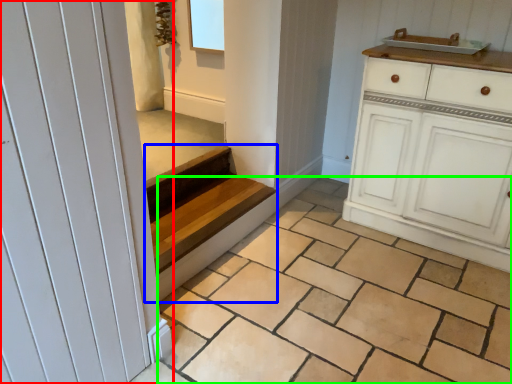
Question: Which is farther away from door (highlighted by a red box)? stairs (highlighted by a blue box) or tile (highlighted by a green box)?

Choices:
 (A) stairs
 (B) tile

Answer: (A)